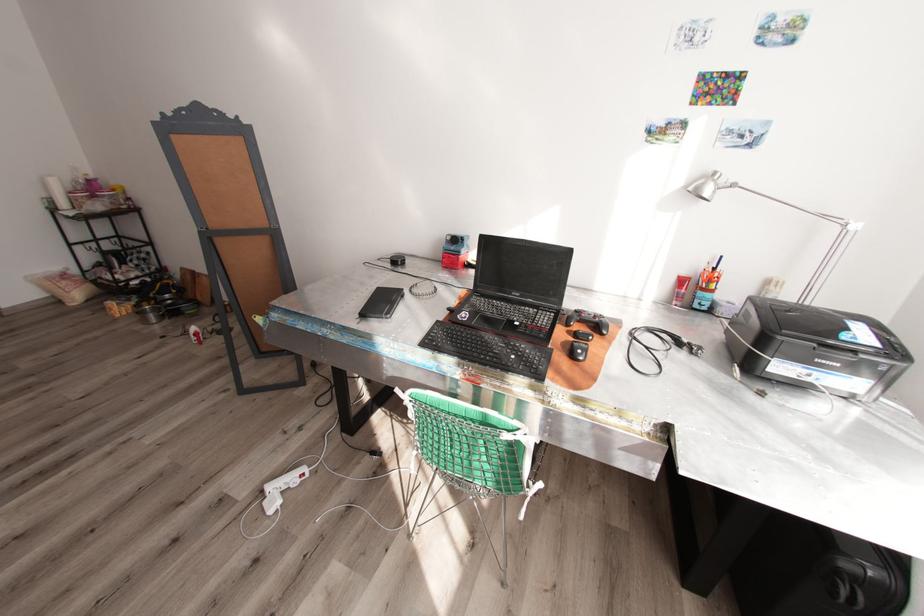
What are the coordinates of `black game controller` in the screenshot? It's located at tap(589, 320).